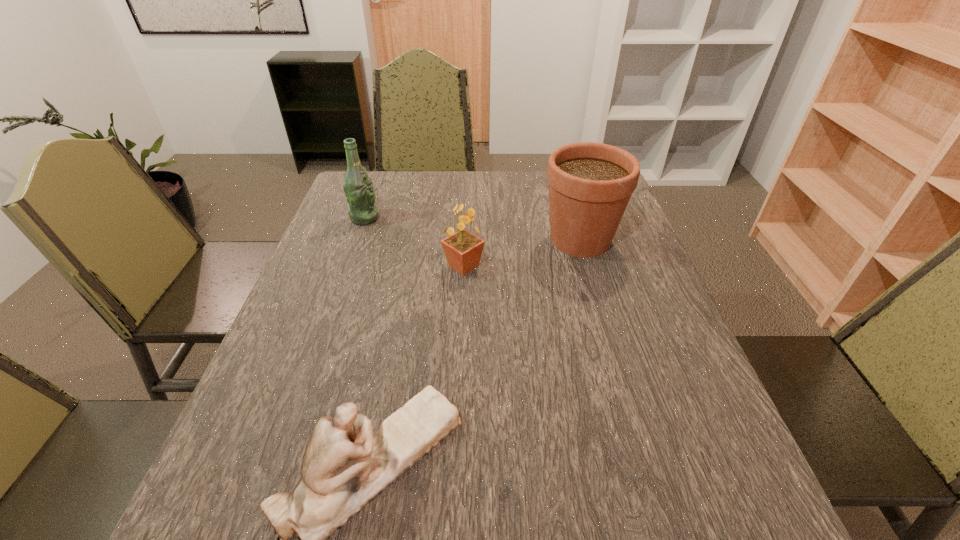
You are a GUI agent. You are given a task and a screenshot of the screen. Output one action in this format:
    pyautogui.click(x=<x>, y=<y>)
    Task: Click on the vacant area that satisfies the following two spatial constraints: 1. on the surface of the rightmost object; 2. on the left side of the beer bottle
    The height and width of the screenshot is (540, 960).
    Given the screenshot: What is the action you would take?
    357,240

Image resolution: width=960 pixels, height=540 pixels. I want to click on vacant space that satisfies the following two spatial constraints: 1. on the back side of the flowerpot; 2. on the surface of the beer bottle, so click(x=574, y=218).